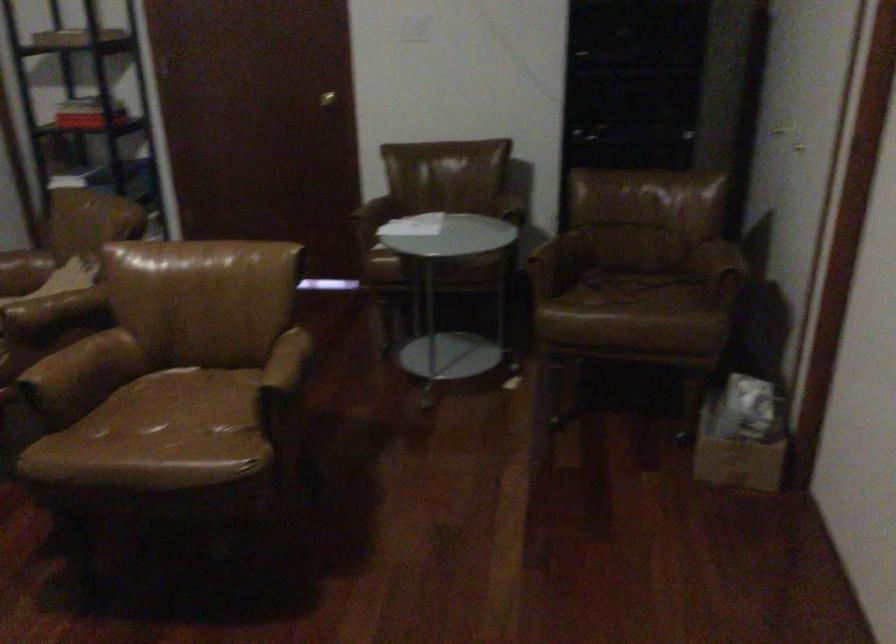
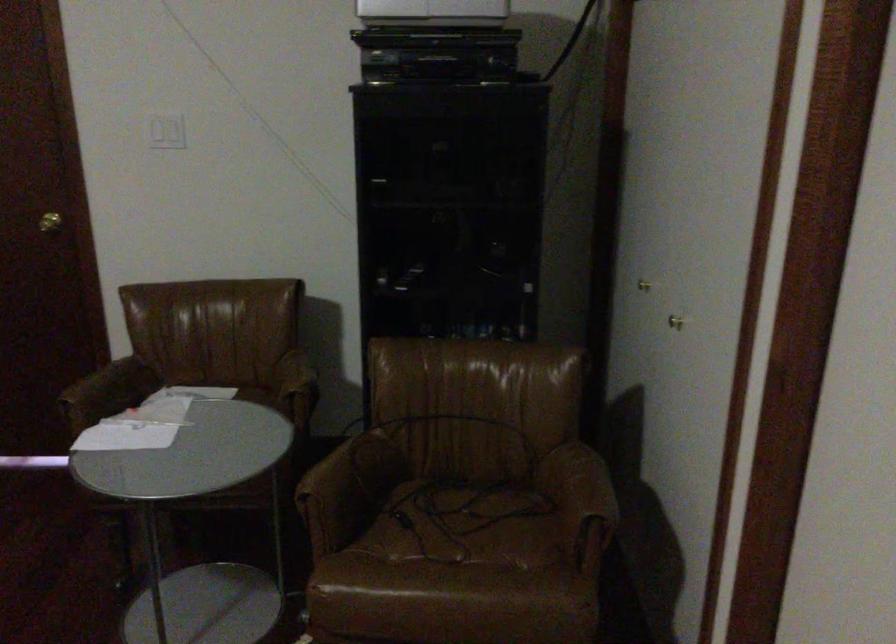
The point at (x=633, y=289) is marked in the first image. Where is the corresponding point in the second image?

(464, 525)